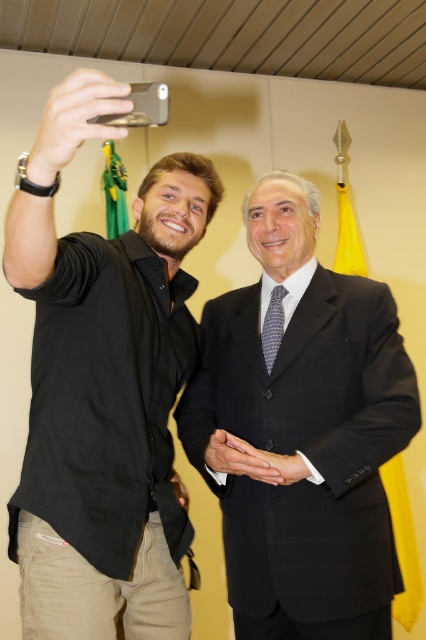
Question: Which object is closer to the camera taking this photo?

Choices:
 (A) black matte shirt at left
 (B) matte black suit at center

Answer: (A)

Question: Can you confirm if black matte shirt at left is positioned above blue dotted tie at center?

Choices:
 (A) yes
 (B) no

Answer: (B)

Question: Based on their relative distances, which object is nearer to the blue dotted tie at center?

Choices:
 (A) matte black suit at center
 (B) black matte shirt at left

Answer: (A)

Question: Is matte black suit at center thinner than blue dotted tie at center?

Choices:
 (A) yes
 (B) no

Answer: (B)

Question: Which object appears farthest from the camera in this image?

Choices:
 (A) matte black suit at center
 (B) blue dotted tie at center
 (C) black matte shirt at left

Answer: (B)

Question: Is matte black suit at center smaller than blue dotted tie at center?

Choices:
 (A) no
 (B) yes

Answer: (A)